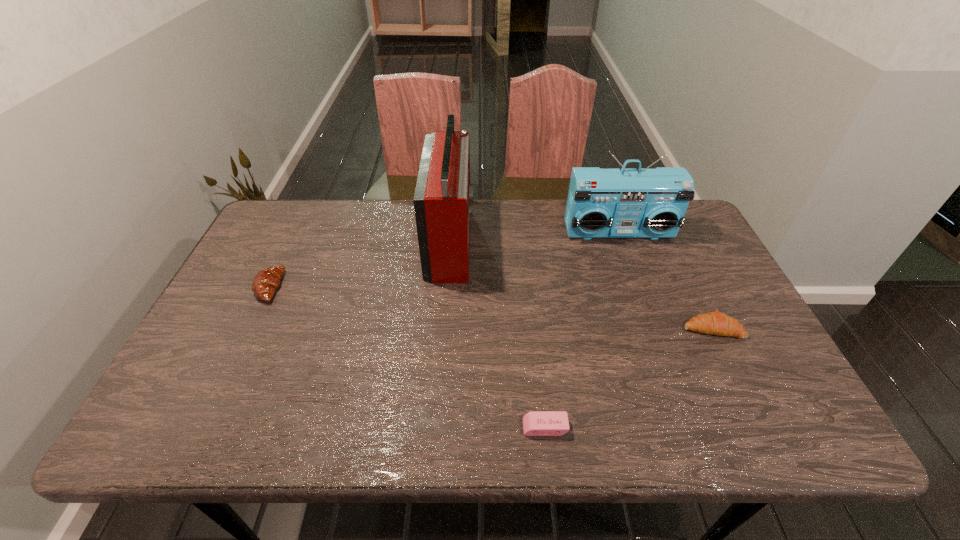
At what (x,y) coordinates should I click in order to perform the action: click on free location at the far edge of the desktop. Please return your answer as a coordinate pair (x, y). Looking at the image, I should click on (537, 208).

In the image, there is a desktop. At what (x,y) coordinates should I click in order to perform the action: click on vacant space at the near edge. Please return your answer as a coordinate pair (x, y). This screenshot has height=540, width=960. Looking at the image, I should click on (588, 434).

I want to click on free region at the left edge of the desktop, so click(x=241, y=362).

Where is `vacant space at the right edge`? The width and height of the screenshot is (960, 540). vacant space at the right edge is located at coordinates (680, 249).

The height and width of the screenshot is (540, 960). What are the coordinates of `free spot at the far left corner of the desktop` in the screenshot? It's located at (280, 217).

This screenshot has width=960, height=540. I want to click on free space between the right crescent roll and the leftmost object, so click(491, 307).

This screenshot has width=960, height=540. Identify the location of empty space that is in between the tallest object and the left crescent roll. (360, 264).

Image resolution: width=960 pixels, height=540 pixels. Identify the location of blank region between the shorter radio receiver and the shortest object. pos(582,329).

You are a GUI agent. You are given a task and a screenshot of the screen. Output one action in this format:
    pyautogui.click(x=<x>, y=<y>)
    Task: Click on the unoccupied area between the eraser and the leftmost object
    This screenshot has width=960, height=540.
    Given the screenshot: What is the action you would take?
    pyautogui.click(x=407, y=357)

Find the location of `free area in between the taller radio receiver and the second nearest object`. free area in between the taller radio receiver and the second nearest object is located at coordinates (582, 284).